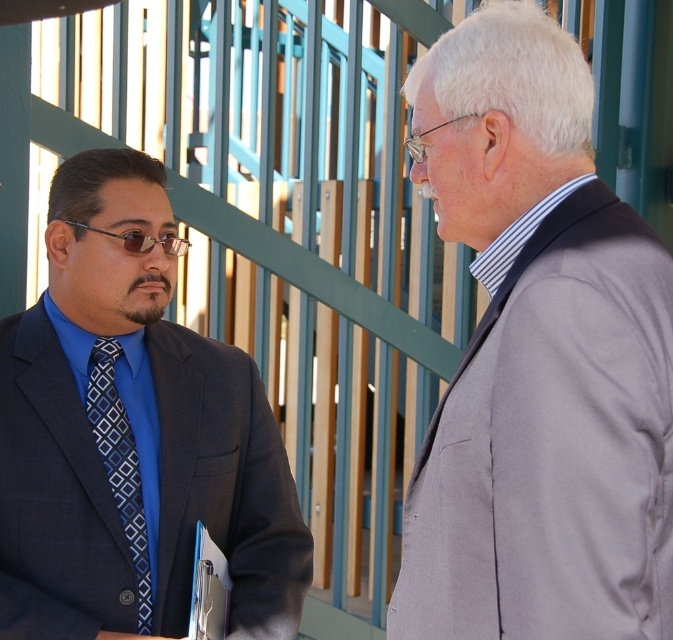
Between matte black suit at left and blue diamond-patterned tie at left, which one has less height?

Standing shorter between the two is blue diamond-patterned tie at left.

Can you confirm if matte black suit at left is shorter than blue diamond-patterned tie at left?

No, matte black suit at left is not shorter than blue diamond-patterned tie at left.

Find the location of a particular element. The width and height of the screenshot is (673, 640). matte black suit at left is located at coordinates (133, 435).

Between gray wool suit at right and matte black suit at left, which one has more height?

gray wool suit at right is taller.

Is gray wool suit at right positioned in front of matte black suit at left?

Yes, gray wool suit at right is closer to the viewer.

Is point (532, 259) in front of point (79, 468)?

Yes, it is.

At what (x,y) coordinates should I click in order to perform the action: click on gray wool suit at right. Please return your answer as a coordinate pair (x, y). This screenshot has height=640, width=673. Looking at the image, I should click on pyautogui.click(x=538, y=358).

Does gray wool suit at right have a greater height compared to blue diamond-patterned tie at left?

Correct, gray wool suit at right is much taller as blue diamond-patterned tie at left.

Is the position of gray wool suit at right less distant than that of blue diamond-patterned tie at left?

Yes, gray wool suit at right is in front of blue diamond-patterned tie at left.

Is point (670, 547) positioned in front of point (114, 406)?

Yes, it is.

Image resolution: width=673 pixels, height=640 pixels. Identify the location of gray wool suit at right. (538, 358).